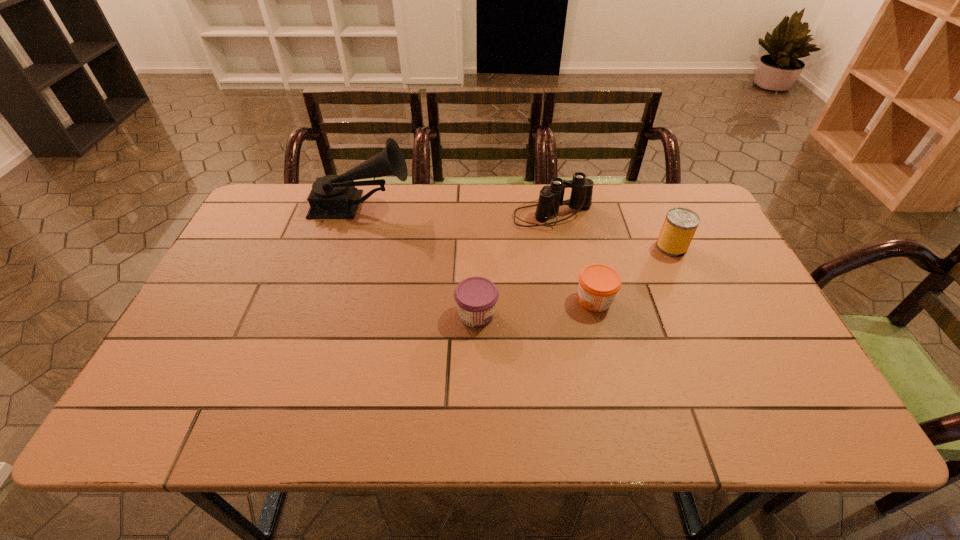
Image resolution: width=960 pixels, height=540 pixels. I want to click on free spot between the fourth object from right to left and the phonograph_record, so click(x=419, y=261).

The image size is (960, 540). In order to click on free spot between the right jam and the binoculars in this screenshot , I will do `click(574, 258)`.

Locate which object ranks third in proximity to the binoculars. Please provide its 2D coordinates. Your answer should be formatted as a tuple, i.e. [(x, y)], where the tuple contains the x and y coordinates of a point satisfying the conditions above.

[(476, 297)]

Select which object appears as the second closest to the left jam. Please provide its 2D coordinates. Your answer should be formatted as a tuple, i.e. [(x, y)], where the tuple contains the x and y coordinates of a point satisfying the conditions above.

[(551, 197)]

The image size is (960, 540). In order to click on vacant space that satisfies the following two spatial constraints: 1. on the front side of the binoculars; 2. on the right side of the can in this screenshot , I will do `click(559, 247)`.

Locate an element on the screen. This screenshot has width=960, height=540. vacant space that satisfies the following two spatial constraints: 1. on the front side of the rightmost object; 2. on the front label of the right jam is located at coordinates (695, 300).